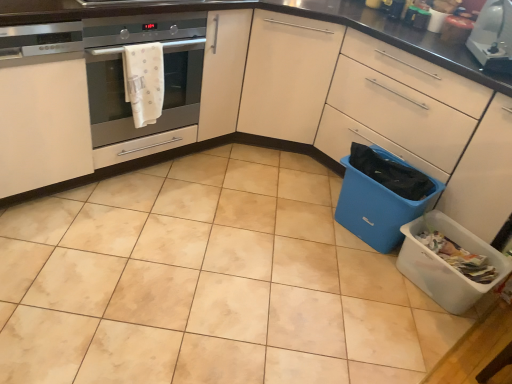
Locate an element on the screen. Image resolution: width=512 pixels, height=384 pixels. blank space above beige glossy tile at center (from a real-world perspective) is located at coordinates (219, 284).